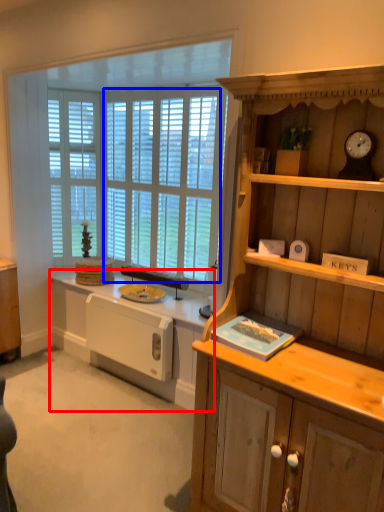
Question: Which object is further to the camera taking this photo, countertop (highlighted by a red box) or window screen (highlighted by a blue box)?

Choices:
 (A) countertop
 (B) window screen

Answer: (B)